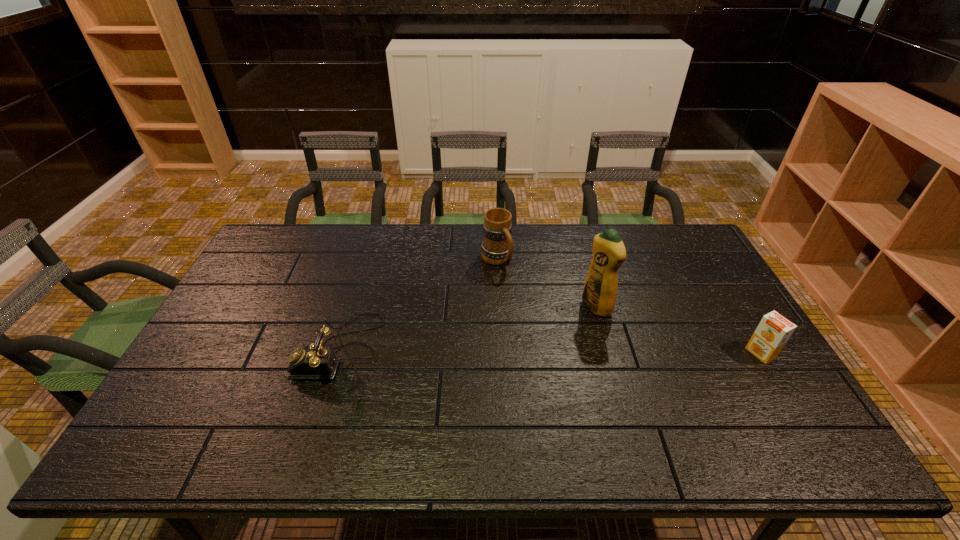
This screenshot has height=540, width=960. What are the coordinates of `the leftmost object` in the screenshot? It's located at (317, 361).

Identify the location of the rightmost object. This screenshot has height=540, width=960. (774, 330).

Locate an element on the screen. the tallest object is located at coordinates (599, 294).

Locate an element on the screen. This screenshot has height=540, width=960. detergent is located at coordinates (599, 294).

The height and width of the screenshot is (540, 960). What are the coordinates of `the second object from left to right` in the screenshot? It's located at pos(497,247).

Where is `mug`? mug is located at coordinates (497, 247).

The image size is (960, 540). I want to click on free point located 0.140m on the dial of the leftmost object, so click(x=251, y=349).

Find the location of a particular element. The height and width of the screenshot is (540, 960). vacant space located 0.090m on the dial of the leftmost object is located at coordinates point(269,349).

Image resolution: width=960 pixels, height=540 pixels. I want to click on vacant space situated on the dial of the leftmost object, so click(x=254, y=349).

Identify the location of free location located on the back of the rightmost object. This screenshot has height=540, width=960. (733, 309).